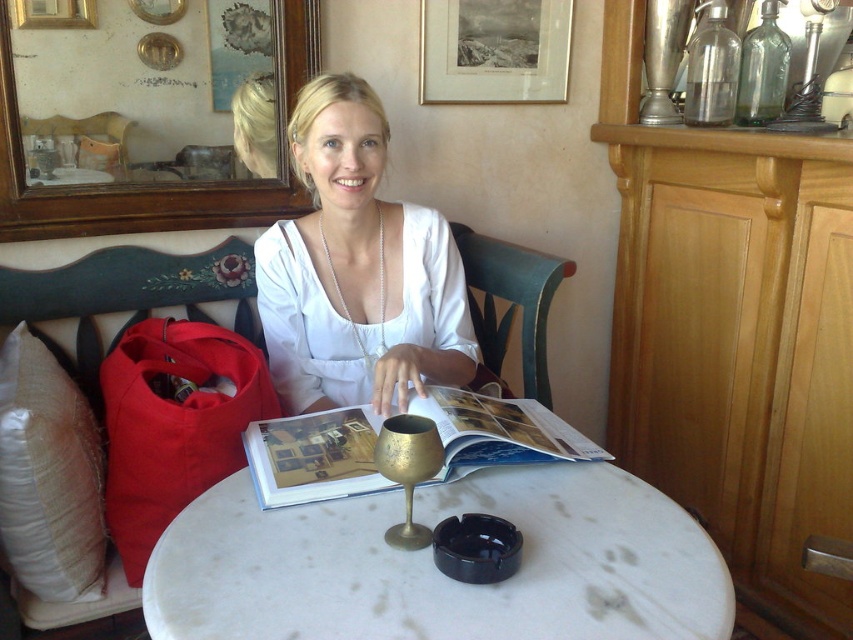
What object is located at the coordinate point (436, 570) in the image?

The white marble table at center is located at the coordinate point (436, 570).